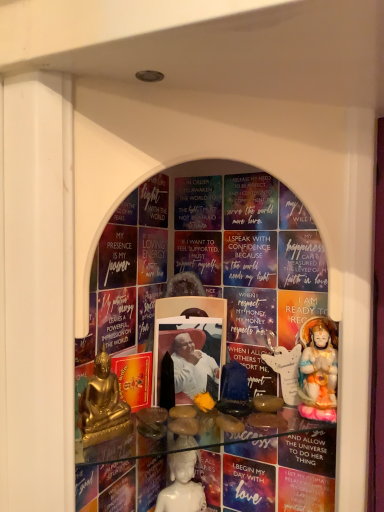
Question: Is white porcelain statue at center, the third person positioned from the top, surrounded by porcelain statue at right, the second person viewed from the back?

Choices:
 (A) yes
 (B) no

Answer: (B)

Question: Considering the relative sizes of porcelain statue at right, positioned as the 3th person in bottom-to-top order, and white porcelain statue at center, marked as the first person in a back-to-front arrangement, in the image provided, is porcelain statue at right, positioned as the 3th person in bottom-to-top order, wider than white porcelain statue at center, marked as the first person in a back-to-front arrangement,?

Choices:
 (A) yes
 (B) no

Answer: (A)

Question: Is porcelain statue at right, which appears as the 3th person when viewed from the left, in front of white porcelain statue at center, the 3th person when ordered from front to back?

Choices:
 (A) no
 (B) yes

Answer: (B)

Question: Is porcelain statue at right, the 1th person in the top-to-bottom sequence, shorter than white porcelain statue at center, which is the second person from left to right?

Choices:
 (A) no
 (B) yes

Answer: (A)

Question: Does porcelain statue at right, positioned as the 3th person in bottom-to-top order, have a greater height compared to white porcelain statue at center, which is the second person from left to right?

Choices:
 (A) yes
 (B) no

Answer: (A)

Question: Considering the positions of porcelain statue at right, positioned as the 3th person in bottom-to-top order, and white porcelain statue at center, the second person in the right-to-left sequence, in the image, is porcelain statue at right, positioned as the 3th person in bottom-to-top order, bigger or smaller than white porcelain statue at center, the second person in the right-to-left sequence,?

Choices:
 (A) small
 (B) big

Answer: (B)

Question: From their relative heights in the image, would you say porcelain statue at right, the 1th person in the top-to-bottom sequence, is taller or shorter than white porcelain statue at center, which is the second person from left to right?

Choices:
 (A) tall
 (B) short

Answer: (A)

Question: Looking at their shapes, would you say porcelain statue at right, positioned as the 3th person in bottom-to-top order, is wider or thinner than white porcelain statue at center, marked as the first person in a back-to-front arrangement?

Choices:
 (A) thin
 (B) wide

Answer: (B)

Question: From a real-world perspective, is porcelain statue at right, positioned as the 3th person in bottom-to-top order, positioned above or below white porcelain statue at center, the third person positioned from the top?

Choices:
 (A) below
 (B) above

Answer: (B)

Question: In the image, is gold metallic statue at lower left, which ranks as the second person in bottom-to-top order, on the left side or the right side of white porcelain statue at center, the 3th person when ordered from front to back?

Choices:
 (A) left
 (B) right

Answer: (A)

Question: From a real-world perspective, is gold metallic statue at lower left, placed as the first person when sorted from front to back, above or below white porcelain statue at center, the first person when ordered from bottom to top?

Choices:
 (A) below
 (B) above

Answer: (B)

Question: In the image, is gold metallic statue at lower left, which ranks as the second person in bottom-to-top order, positioned in front of or behind white porcelain statue at center, the first person when ordered from bottom to top?

Choices:
 (A) behind
 (B) front

Answer: (B)

Question: Looking at the image, does gold metallic statue at lower left, which is the 2th person in top-to-bottom order, seem bigger or smaller compared to white porcelain statue at center, the 3th person when ordered from front to back?

Choices:
 (A) big
 (B) small

Answer: (A)

Question: In the image, is white porcelain statue at center, the first person when ordered from bottom to top, positioned in front of or behind gold metallic statue at lower left, which is counted as the third person, starting from the back?

Choices:
 (A) behind
 (B) front

Answer: (A)

Question: From the image's perspective, is white porcelain statue at center, marked as the first person in a back-to-front arrangement, positioned above or below gold metallic statue at lower left, which is counted as the third person, starting from the back?

Choices:
 (A) below
 (B) above

Answer: (A)